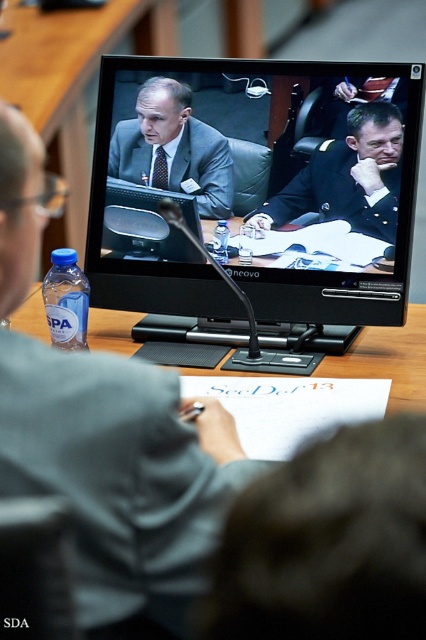
How much distance is there between dark gray suit at lower right and matte gray suit at center?

dark gray suit at lower right is 1.24 meters away from matte gray suit at center.

Does point (365, 513) lie behind point (196, 141)?

That is False.

Find the location of a particular element. dark gray suit at lower right is located at coordinates (328, 541).

Based on the photo, who is higher up, matte black monitor at center or dark blue uniform at center?

matte black monitor at center

Is point (268, 248) closer to viewer compared to point (357, 125)?

No.

This screenshot has width=426, height=640. In order to click on matte black monitor at center in this screenshot , I will do `click(256, 186)`.

Between point (170, 458) and point (290, 515), which one is positioned in front?

Point (290, 515)

From the picture: Between matte black laptop at left and dark gray suit at lower right, which one is positioned higher?

matte black laptop at left is higher up.

Describe the element at coordinates (120, 477) in the screenshot. I see `matte black laptop at left` at that location.

At what (x,y) coordinates should I click in order to perform the action: click on matte black laptop at left. Please return your answer as a coordinate pair (x, y). Looking at the image, I should click on (120, 477).